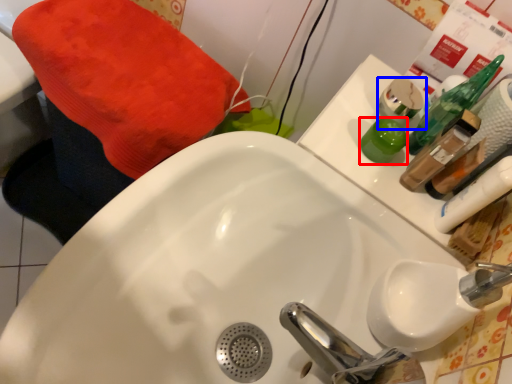
Question: Which object appears closest to the camera in this image, mouthwash (highlighted by a red box) or mouthwash (highlighted by a blue box)?

Choices:
 (A) mouthwash
 (B) mouthwash

Answer: (A)